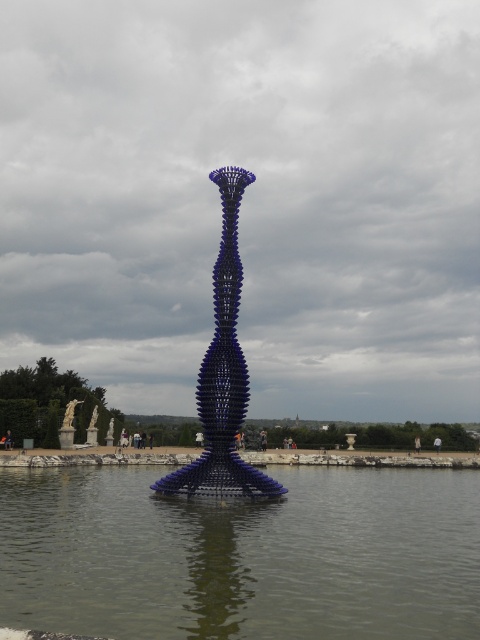
You are standing in the formal garden and want to take a photo of the blue sculpture. You notice two points marked on the sculpture. One is at point (206, 356) and the other at point (70, 444). Which point is closer to your camera when you take the photo?

Point (206, 356) is closer to the camera than point (70, 444).

You are standing at the edge of the pond and want to take a photo of the blue sculpture. To ensure the transparent water at center is in the frame, where should you position your camera? Specify the coordinates based on the image grid where the center is at point 0.869, 0.506.

The transparent water at center is located at coordinates (242, 556). To capture it in the frame, position your camera so that this point is centered in your viewfinder.

You are standing at the edge of the pond looking at the blue sculpture. A drone is hovering at point (237,208). Can you see the drone clearly from your position?

The distance of point (237,208) from camera is 43.58 meters, so the drone at that point is too far away to be seen clearly from the edge of the pond.